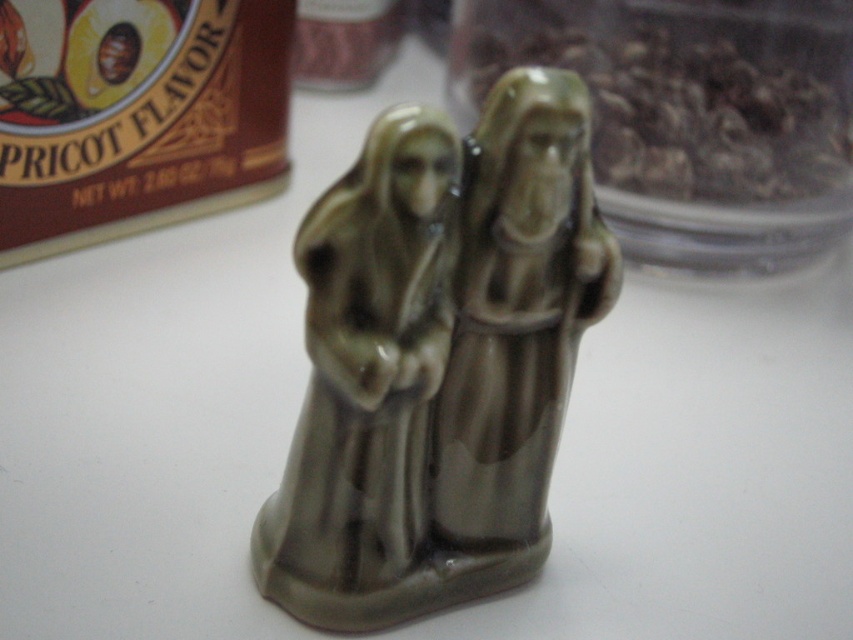
Question: Is matte ceramic figures at center to the right of translucent plastic jar at upper right from the viewer's perspective?

Choices:
 (A) yes
 (B) no

Answer: (B)

Question: Is matte ceramic figures at center further to the viewer compared to translucent plastic jar at upper right?

Choices:
 (A) yes
 (B) no

Answer: (B)

Question: Can you confirm if matte ceramic figures at center is positioned to the right of translucent plastic jar at upper right?

Choices:
 (A) no
 (B) yes

Answer: (A)

Question: Which point is closer to the camera taking this photo?

Choices:
 (A) (752, 250)
 (B) (308, 502)

Answer: (B)

Question: Which object appears closest to the camera in this image?

Choices:
 (A) translucent plastic jar at upper right
 (B) matte ceramic figures at center

Answer: (B)